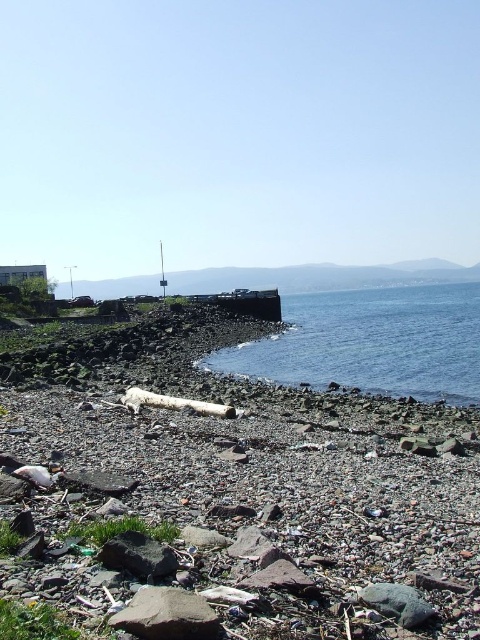
You are standing on the rough stone beach at lower left and want to reach the gray rough rock at lower center. Based on the scene description, which direction should you move to get there?

You should move upward from the rough stone beach at lower left to reach the gray rough rock at lower center since the rough stone beach at lower left is below gray rough rock at lower center.